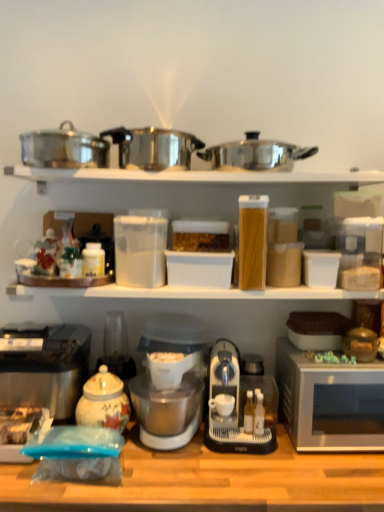
Locate an element on the screen. blank space situated above wooden table at lower center (from a real-world perspective) is located at coordinates (213, 459).